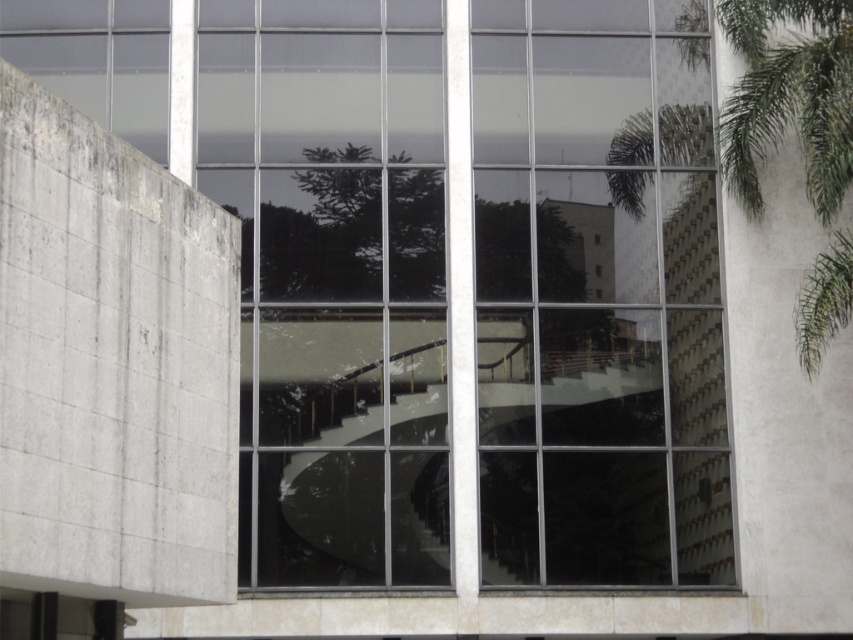
You are an architect analyzing the building layout. You notice the transparent glass window at center and the green leafy palm tree at right. Which object is located higher in the image?

The transparent glass window at center is positioned over the green leafy palm tree at right, meaning it is higher up in the image.

In the scene shown: You are an architect designing a new building and want to incorporate plants in the design. Based on the image, which of the two green leafy palm tree at right and green leafy tree at center would you choose if you want a taller plant for the central area?

The green leafy tree at center is taller than the green leafy palm tree at right, so you should choose the green leafy tree at center for a taller plant in the central area.